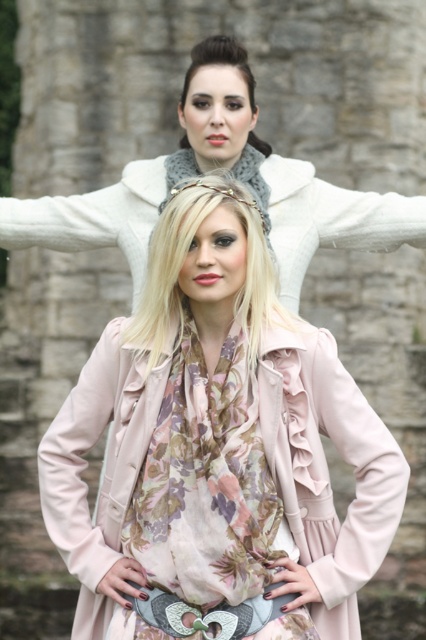
Who is more distant from viewer, (158, 396) or (374, 476)?

The point (158, 396) is more distant.

Does pink fabric coat at center have a lesser width compared to matte pink coat at center?

No.

Between point (213, 333) and point (322, 346), which one is positioned behind?

Positioned behind is point (213, 333).

Where is `pink fabric coat at center`? This screenshot has height=640, width=426. pink fabric coat at center is located at coordinates (218, 442).

Can you confirm if matte white scarf at upper center is taller than matte pink coat at lower left?

Correct, matte white scarf at upper center is much taller as matte pink coat at lower left.

Is matte white scarf at upper center positioned behind matte pink coat at lower left?

Yes, matte white scarf at upper center is behind matte pink coat at lower left.

Is point (287, 166) closer to viewer compared to point (100, 556)?

No, (287, 166) is further to viewer.

Image resolution: width=426 pixels, height=640 pixels. Find the location of `matte white scarf at upper center`. matte white scarf at upper center is located at coordinates (216, 170).

Between matte pink coat at center and matte pink coat at lower left, which one has more height?

Standing taller between the two is matte pink coat at center.

Measure the distance between point (327, 572) and camera.

Point (327, 572) is 48.63 meters from camera.

Where is `matte pink coat at center`? The width and height of the screenshot is (426, 640). matte pink coat at center is located at coordinates (328, 472).